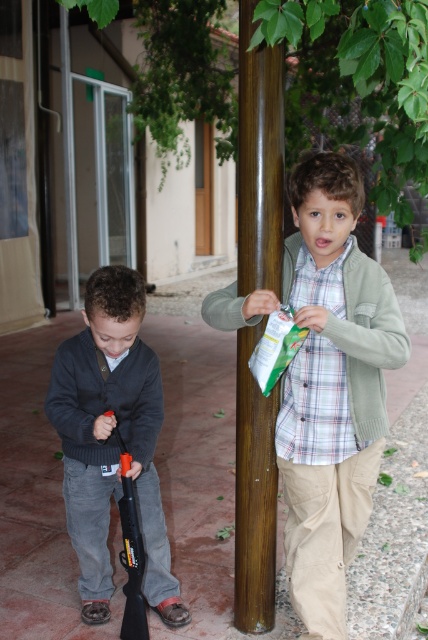
Question: Which point is closer to the camera taking this photo?

Choices:
 (A) (119, 333)
 (B) (136, 596)

Answer: (A)

Question: Does dark gray sweater at left appear over black plastic shotgun at lower left?

Choices:
 (A) yes
 (B) no

Answer: (A)

Question: Can you confirm if plaid cotton shirt at center is smaller than dark gray sweater at left?

Choices:
 (A) no
 (B) yes

Answer: (A)

Question: Among these points, which one is nearest to the camera?

Choices:
 (A) (x=265, y=524)
 (B) (x=92, y=428)
 (C) (x=240, y=326)

Answer: (C)

Question: Can you confirm if plaid cotton shirt at center is positioned to the right of dark gray sweater at left?

Choices:
 (A) no
 (B) yes

Answer: (B)

Question: Among these objects, which one is nearest to the camera?

Choices:
 (A) brown polished wood pole at center
 (B) black plastic shotgun at lower left

Answer: (A)